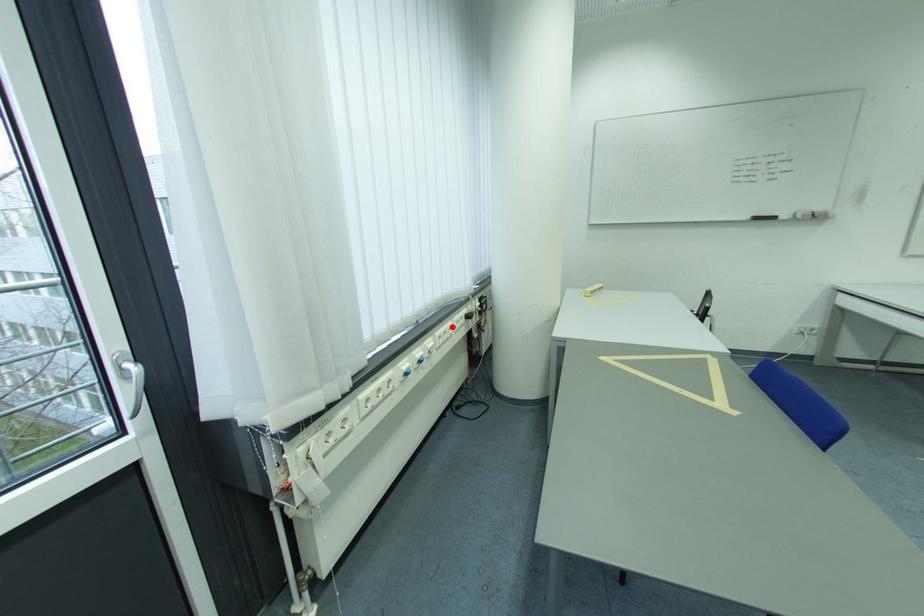
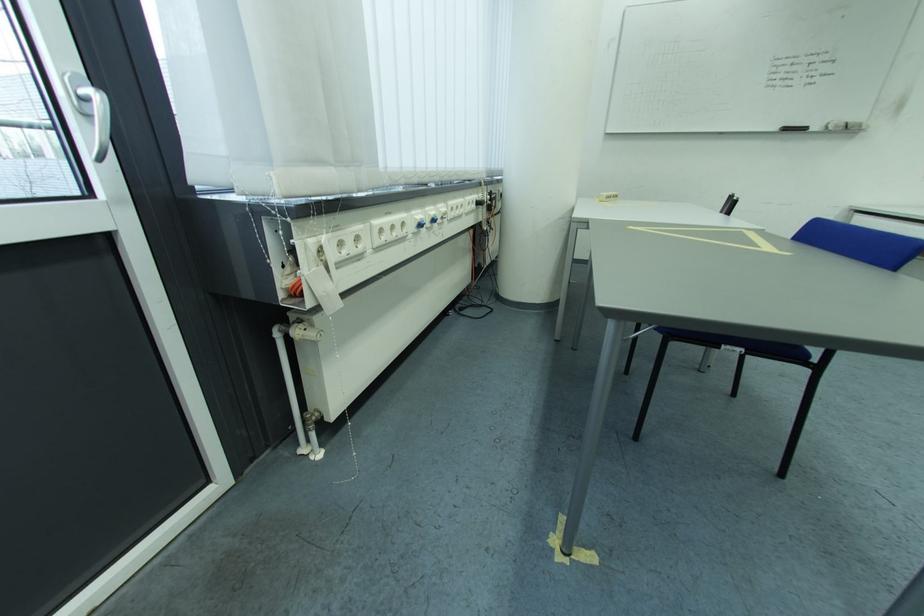
Question: I am providing you with two images of the same scene from different viewpoints. Image1 has a red point marked. In image2, the corresponding 3D location appears at what relative position? Reply with the corresponding letter.

Choices:
 (A) Closer
 (B) Farther

Answer: (A)